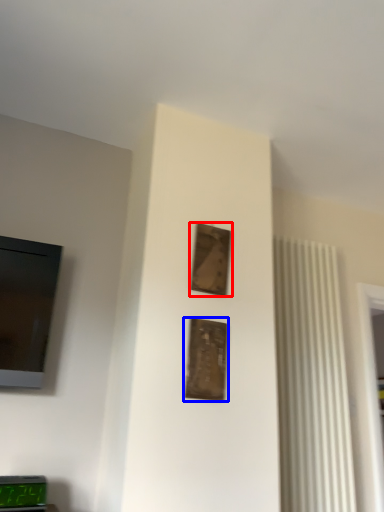
Question: Among these objects, which one is farthest to the camera, picture frame (highlighted by a red box) or picture frame (highlighted by a blue box)?

Choices:
 (A) picture frame
 (B) picture frame

Answer: (A)